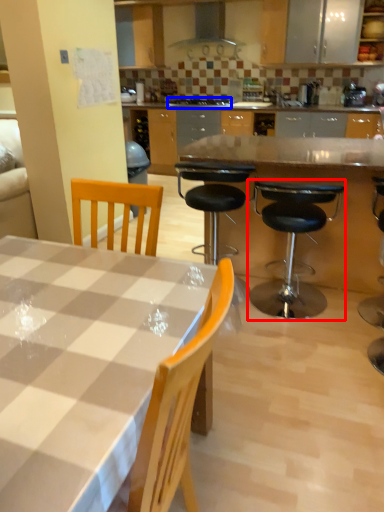
Question: Which of the following is the closest to the observer, chair (highlighted by a red box) or gas stove (highlighted by a blue box)?

Choices:
 (A) chair
 (B) gas stove

Answer: (A)